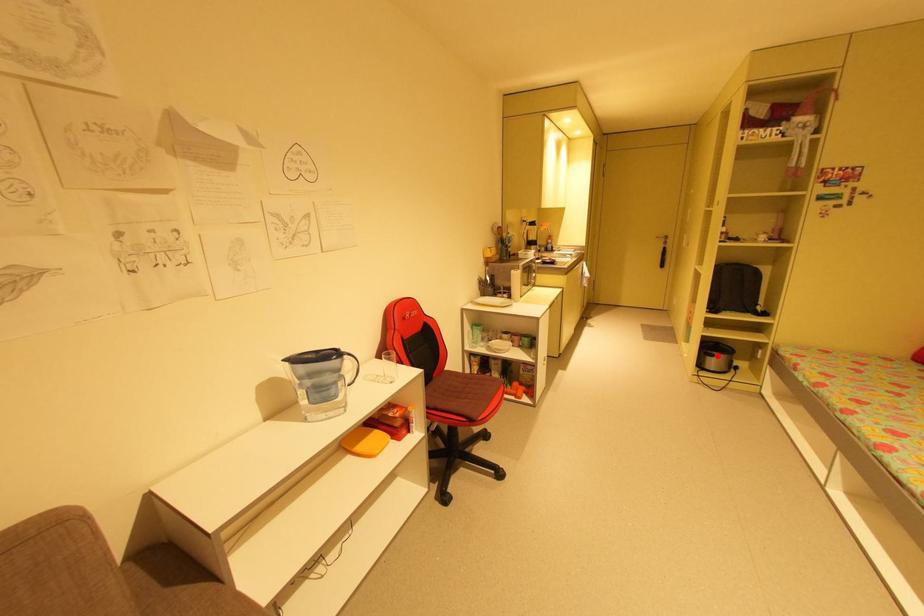
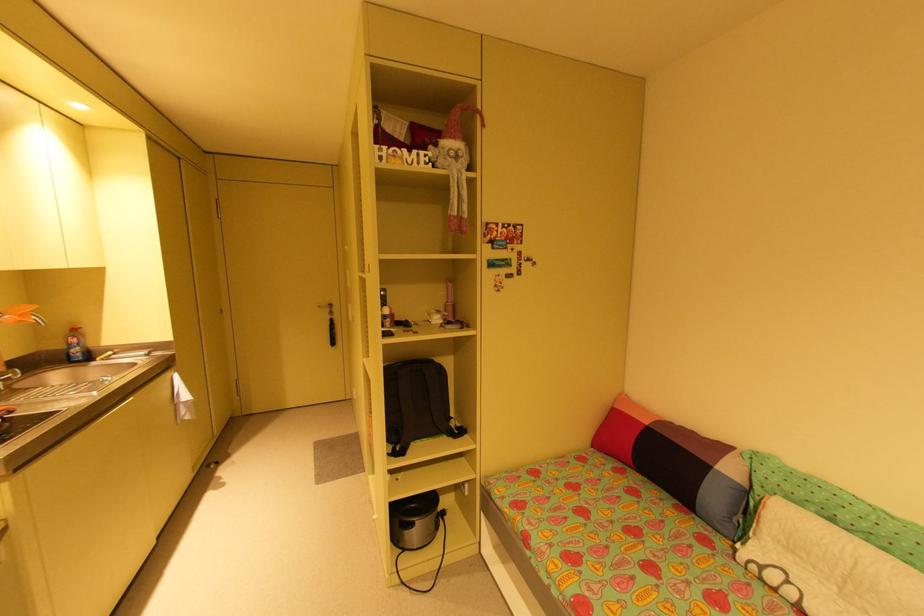
Question: I am providing you with two images of the same scene from different viewpoints. A red point is marked on the first image. Is the red point's position out of view in image 2?

Choices:
 (A) Yes
 (B) No

Answer: (B)